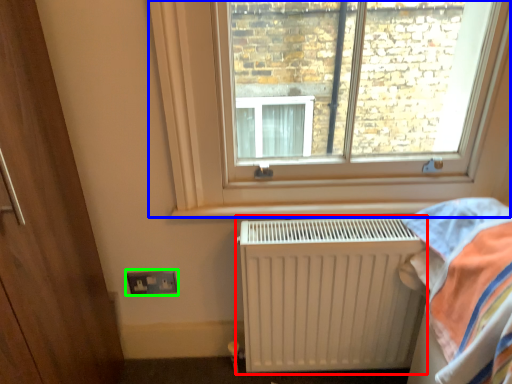
Question: Considering the real-world distances, which object is farthest from radiator (highlighted by a red box)? window (highlighted by a blue box) or electric outlet (highlighted by a green box)?

Choices:
 (A) window
 (B) electric outlet

Answer: (B)